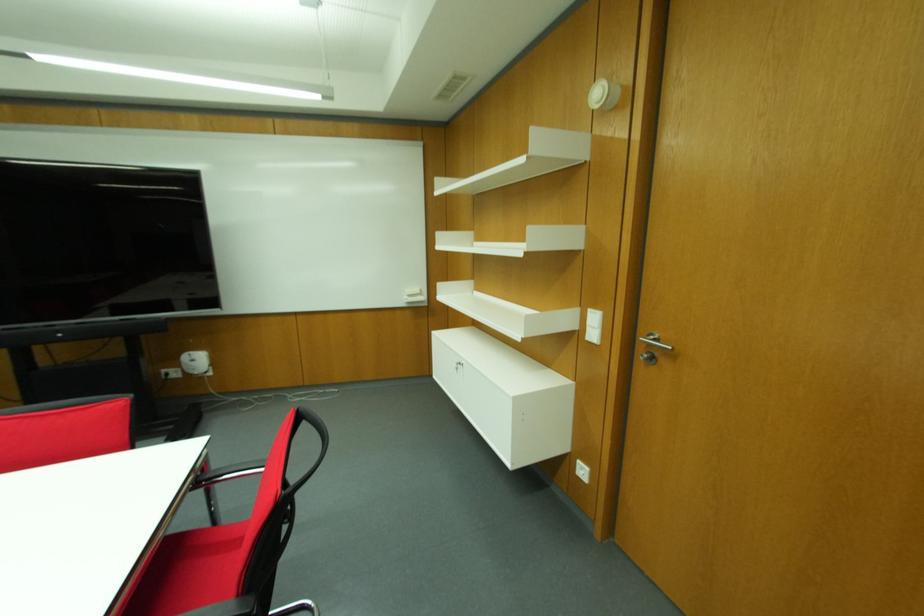
Find the location of a particular element. Image resolution: width=924 pixels, height=616 pixels. white light switch is located at coordinates (592, 326).